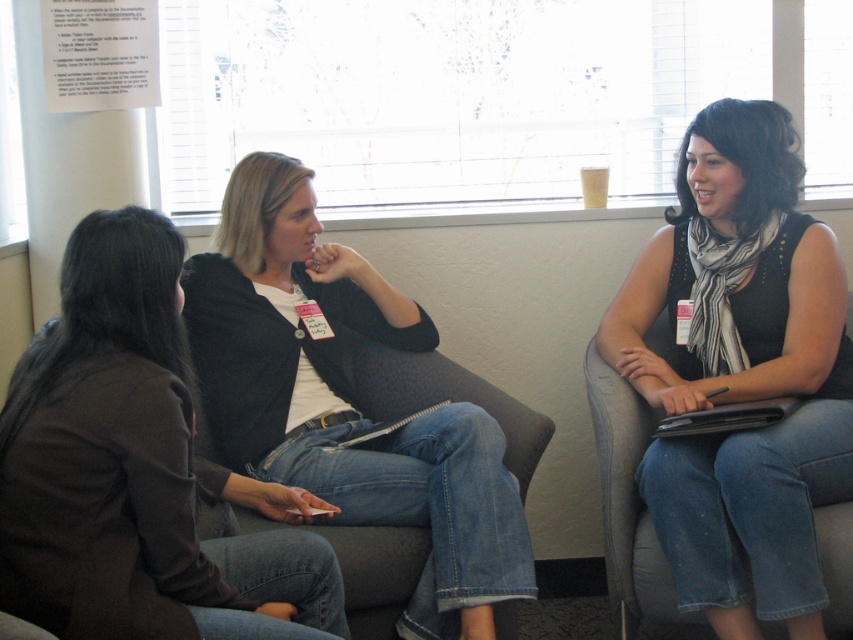
From the picture: How much distance is there between matte black jacket at center and denim jeans at center?

matte black jacket at center and denim jeans at center are 18.68 inches apart from each other.

Between matte black jacket at center and denim jeans at center, which one is positioned lower?

Positioned lower is matte black jacket at center.

Is point (173, 506) positioned behind point (329, 490)?

No, (173, 506) is closer to viewer.

Find the location of `matte black jacket at center`. matte black jacket at center is located at coordinates (135, 468).

Who is lower down, matte black jacket at center or black matte scarf at center?

matte black jacket at center is lower down.

Does point (171, 588) come in front of point (650, 474)?

Yes, point (171, 588) is in front of point (650, 474).

At what (x,y) coordinates should I click in order to perform the action: click on matte black jacket at center. Please return your answer as a coordinate pair (x, y). This screenshot has height=640, width=853. Looking at the image, I should click on (135, 468).

Does black matte scarf at center appear under denim jeans at center?

Actually, black matte scarf at center is above denim jeans at center.

Can you confirm if black matte scarf at center is wider than denim jeans at center?

In fact, black matte scarf at center might be narrower than denim jeans at center.

Does point (709, 365) come closer to viewer compared to point (282, 241)?

No.

You are a GUI agent. You are given a task and a screenshot of the screen. Output one action in this format:
    pyautogui.click(x=<x>, y=<y>)
    Task: Click on the black matte scarf at center
    
    Given the screenshot: What is the action you would take?
    pyautogui.click(x=741, y=372)